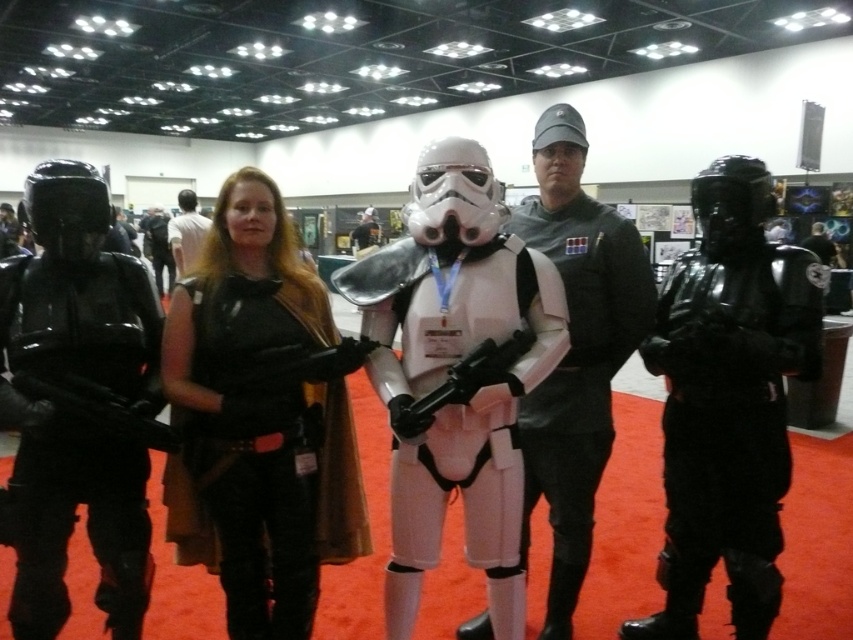
You are a photographer at the event and need to capture a photo of both the shiny black armor at left and the matte black uniform at center. Based on their positions, which object is positioned lower in the image?

The shiny black armor at left is located below the matte black uniform at center, so it is positioned lower in the image.

You are standing at the entrance of the convention hall and want to take a photo of the shiny black armor at left. Where should you position yourself to ensure it is centered in your camera frame?

To center the shiny black armor at left in your camera frame, position yourself directly in front of it at point (73, 413).

You are organizing a group photo and need to arrange the shiny black armor at right and the black matte armor at center side by side. Which one requires more horizontal space to accommodate its width?

The black matte armor at center requires more horizontal space because its width is greater than the shiny black armor at right.